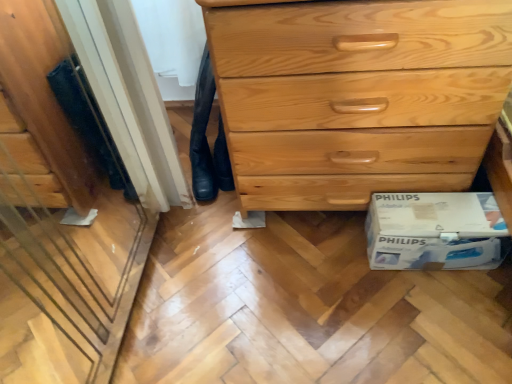
I want to click on free space in front of black leather jeans at lower center, so click(x=221, y=223).